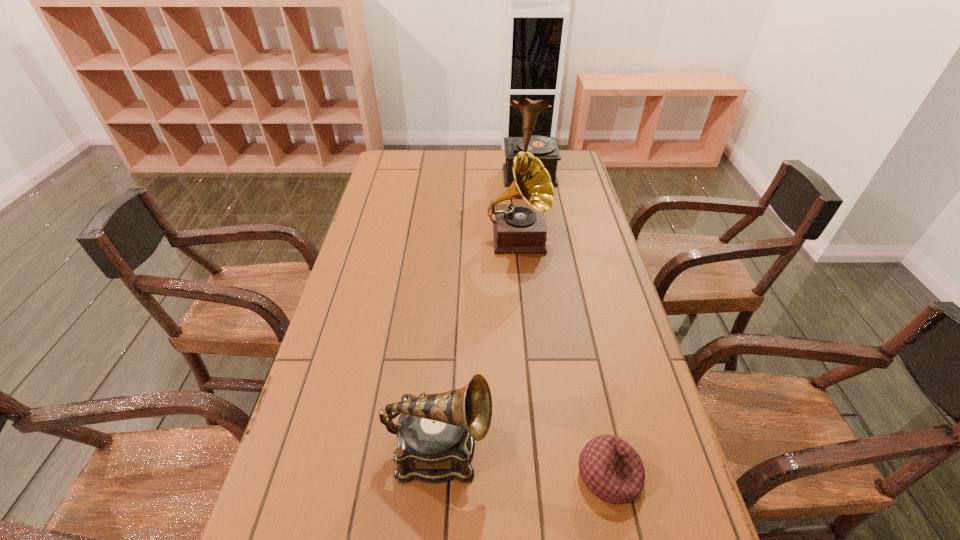
You are a GUI agent. You are given a task and a screenshot of the screen. Output one action in this format:
    pyautogui.click(x=<x>, y=<y>)
    Task: Click on the phonograph_record that is positioned at the right edge
    
    Given the screenshot: What is the action you would take?
    pyautogui.click(x=544, y=148)

This screenshot has height=540, width=960. What are the coordinates of `beanbag that is positioned at the right edge` in the screenshot? It's located at (611, 468).

Locate an element on the screen. object that is at the far right corner is located at coordinates (544, 148).

Find the location of a particular element. vacant space at the far edge of the desktop is located at coordinates (479, 153).

In the image, there is a desktop. At what (x,y) coordinates should I click in order to perform the action: click on vacant space at the left edge. Please return your answer as a coordinate pair (x, y). Looking at the image, I should click on (372, 289).

The height and width of the screenshot is (540, 960). Identify the location of vacant space at the right edge of the desktop. (584, 186).

The width and height of the screenshot is (960, 540). Find the location of `free space at the far left corner`. free space at the far left corner is located at coordinates (417, 154).

The image size is (960, 540). In the image, there is a desktop. Find the location of `vacant space at the far right corner`. vacant space at the far right corner is located at coordinates (572, 152).

The image size is (960, 540). I want to click on vacant space that is in between the farthest object and the shortest phonograph record, so [x=484, y=312].

You are a GUI agent. You are given a task and a screenshot of the screen. Output one action in this format:
    pyautogui.click(x=<x>, y=<y>)
    Task: Click on the vacant area between the shortest object and the farthest object
    The image size is (960, 540).
    Given the screenshot: What is the action you would take?
    click(569, 326)